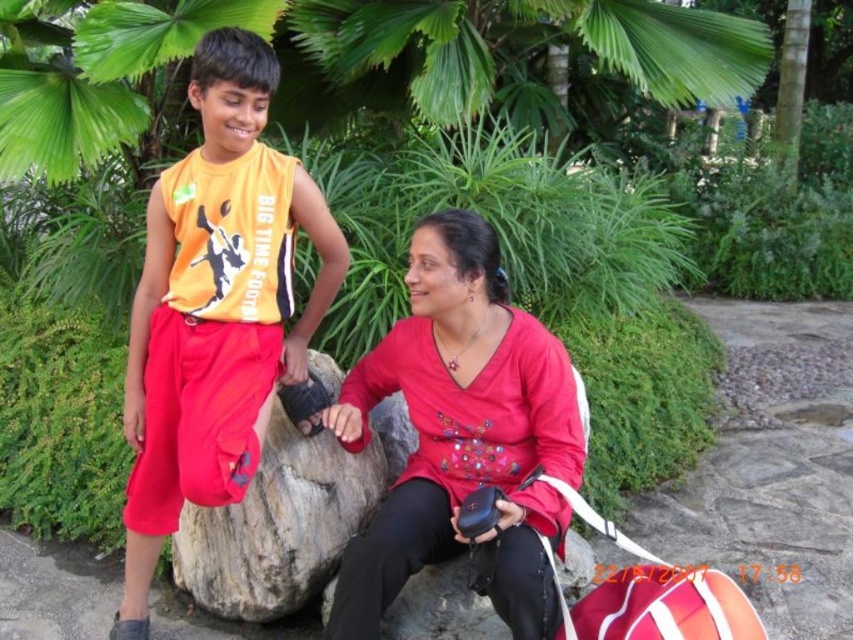
You are a photographer trying to capture a closeup shot of the orange jersey at upper left and the rough textured rock at center. Your camera has a maximum focus range of 15 inches. Can you fit both objects within the frame without moving the camera?

The orange jersey at upper left and the rough textured rock at center are 14.73 inches apart from each other, which is within the camera maximum focus range of 15 inches. Therefore, you can fit both objects within the frame without moving the camera.

You are organizing a charity event and need to decide which of the two items, the orange jersey at upper left or the matte red blouse at center, can fit into a donation box that has a maximum capacity for large items. Based on their sizes, which item is more suitable for the donation box?

The orange jersey at upper left is bigger than the matte red blouse at center, so it is more suitable for the donation box designed for large items.

Consider the image. You are designing a poster for a sports event and need to place the orange jersey at upper left and the rough textured rock at center. Based on their sizes, which object should be placed closer to the edge of the poster to maintain balance?

The orange jersey at upper left might be wider than the rough textured rock at center, so placing the orange jersey at upper left closer to the edge would help balance the composition since it has a larger width.